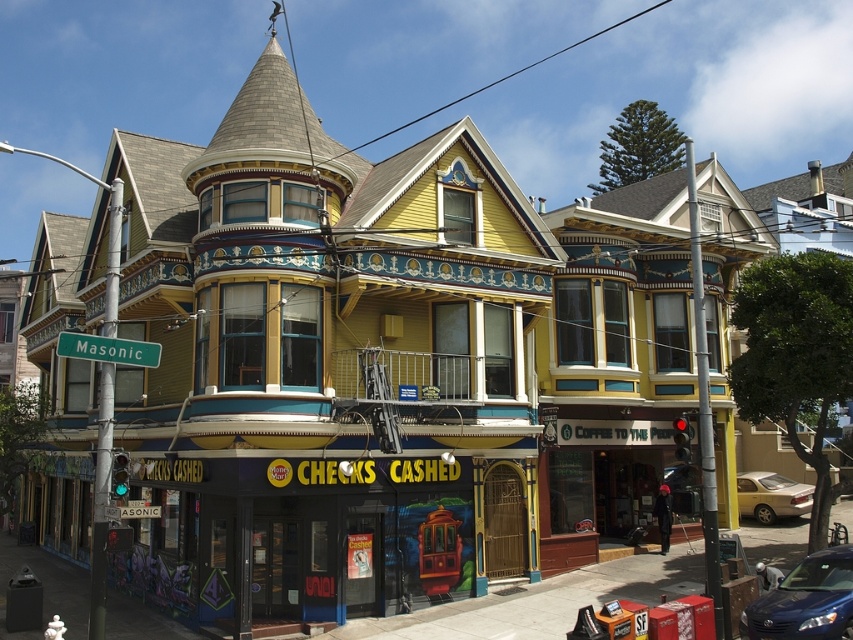
Consider the image. Does blue metallic sedan at lower right lie in front of silver metallic sedan at lower right?

Yes, it is.

Is blue metallic sedan at lower right above silver metallic sedan at lower right?

Yes, blue metallic sedan at lower right is above silver metallic sedan at lower right.

Is point (839, 634) positioned after point (753, 513)?

No, (839, 634) is in front of (753, 513).

Find the location of a particular element. blue metallic sedan at lower right is located at coordinates (805, 600).

Is silver metallic sedan at lower right to the left of green metallic street sign at left from the viewer's perspective?

Incorrect, silver metallic sedan at lower right is not on the left side of green metallic street sign at left.

This screenshot has width=853, height=640. Describe the element at coordinates (770, 497) in the screenshot. I see `silver metallic sedan at lower right` at that location.

The image size is (853, 640). What do you see at coordinates (770, 497) in the screenshot? I see `silver metallic sedan at lower right` at bounding box center [770, 497].

Where is `silver metallic sedan at lower right`? silver metallic sedan at lower right is located at coordinates (770, 497).

Does blue metallic sedan at lower right appear over green metallic street sign at left?

No.

Can you confirm if blue metallic sedan at lower right is shorter than green metallic street sign at left?

In fact, blue metallic sedan at lower right may be taller than green metallic street sign at left.

Does point (779, 584) come closer to viewer compared to point (120, 339)?

No.

This screenshot has height=640, width=853. I want to click on blue metallic sedan at lower right, so click(x=805, y=600).